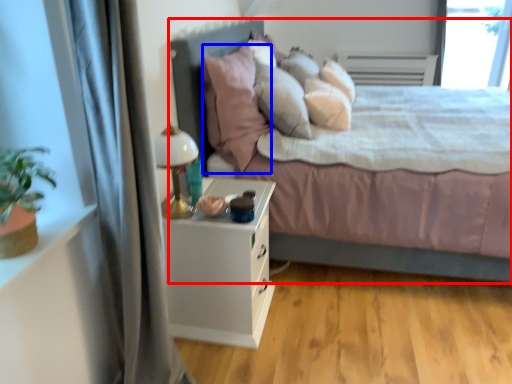
Question: Which of the following is the farthest to the observer, bed (highlighted by a red box) or pillow (highlighted by a blue box)?

Choices:
 (A) bed
 (B) pillow

Answer: (B)